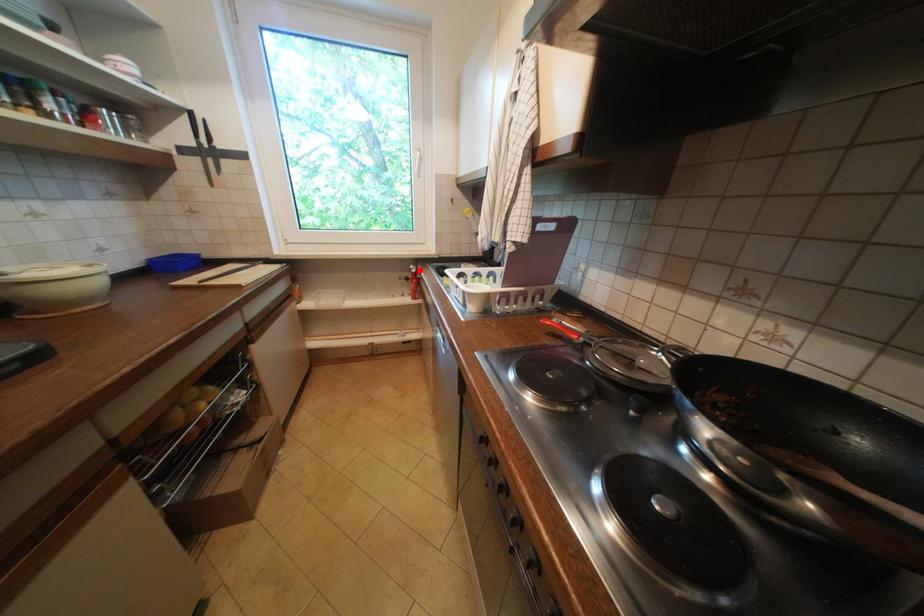
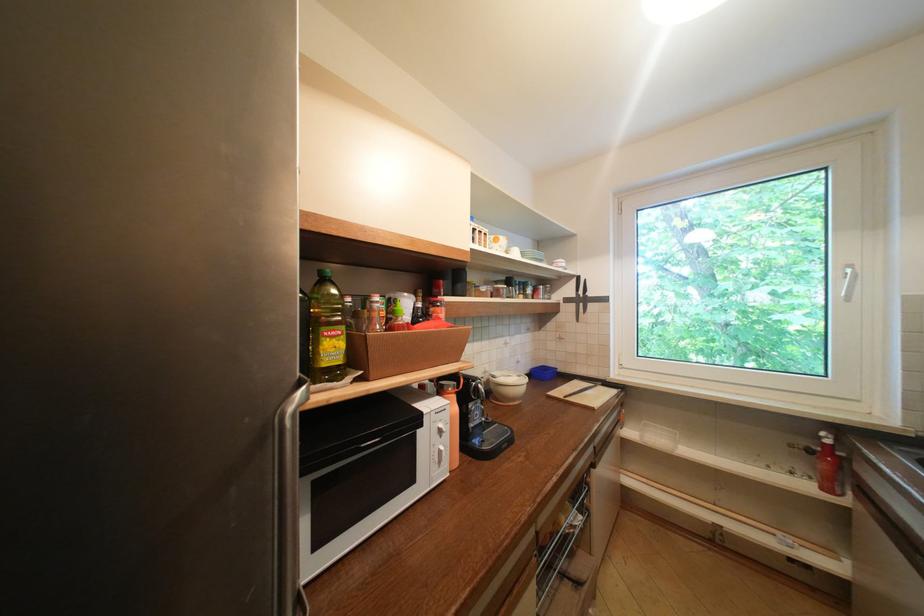
Locate, in the second image, the point that corresponds to the highlighted location in the first image.

(829, 439)